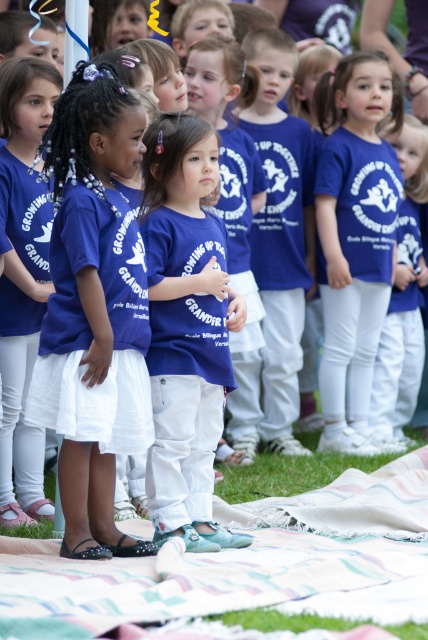
Is patterned fabric blanket at lower center wider than matte blue t-shirt at center?

Correct, the width of patterned fabric blanket at lower center exceeds that of matte blue t-shirt at center.

What are the coordinates of `patterned fabric blanket at lower center` in the screenshot? It's located at (246, 563).